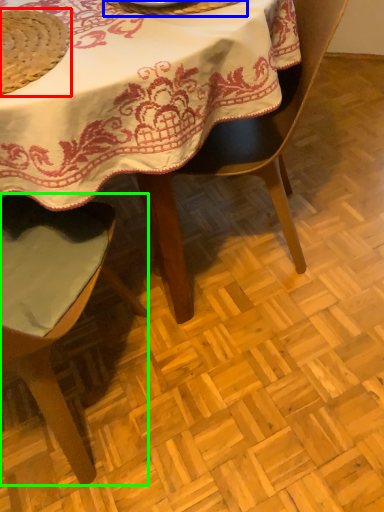
Question: Which is nearer to the straw hat (highlighted by a red box)? tableware (highlighted by a blue box) or chair (highlighted by a green box).

Choices:
 (A) tableware
 (B) chair

Answer: (A)